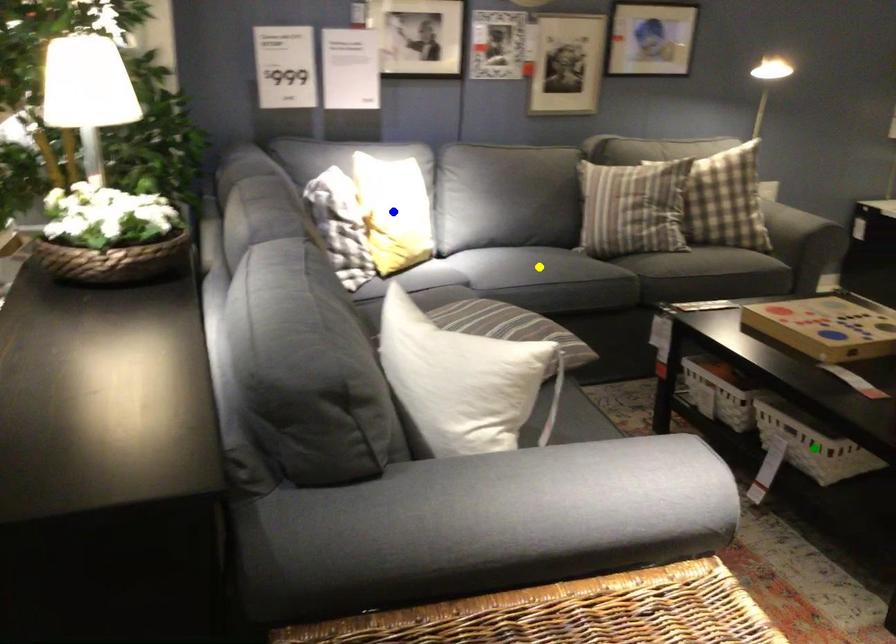
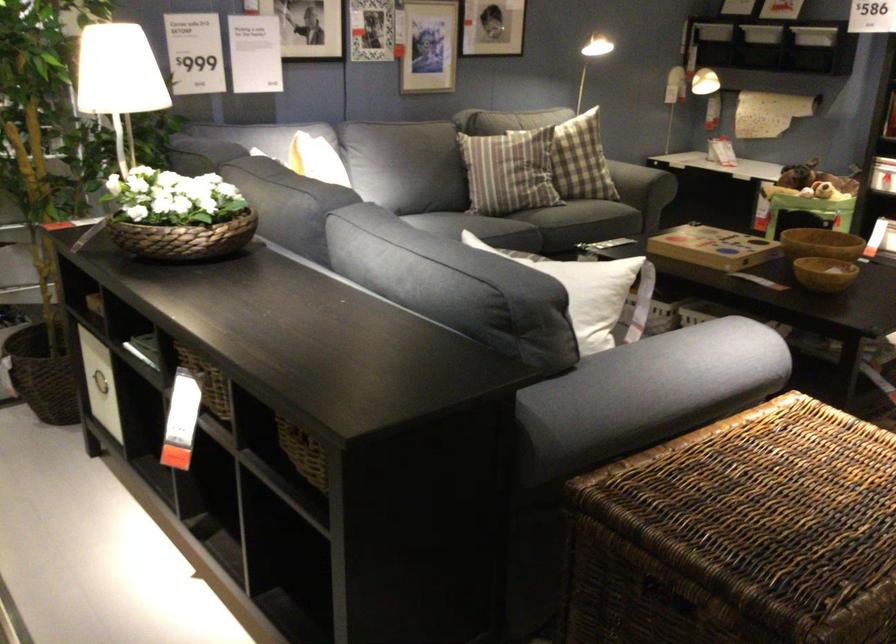
I am providing you with two images of the same scene from different viewpoints. Three points are marked in image1. Which point corresponds to a part or object that is occluded in image2?In image1, three points are marked. Which of them correspond to a part or object that is occluded in image2?Among the three points shown in image1, which one corresponds to a part or object that is no longer visible due to occlusion in image2?

Invisible in image2: green point, yellow point, blue point.